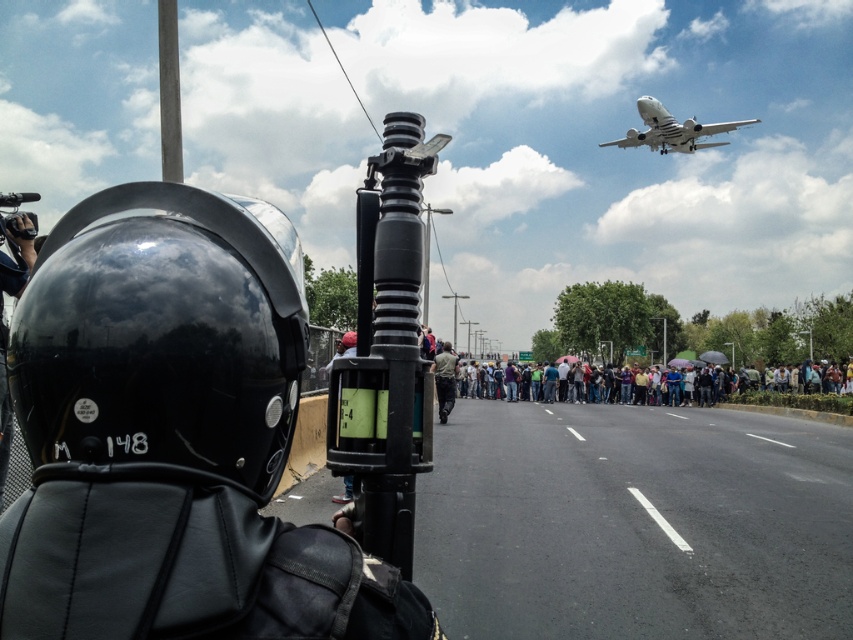
You are standing in the crowd looking towards the road. Which object is closer to you between the matte black helmet at left and the white matte airplane at upper center?

The matte black helmet at left is closer to you because it is positioned under the white matte airplane at upper center, indicating it is in front in the visual hierarchy.

Based on the photo, you are a photographer trying to capture a clear shot of the light brown fabric shirt at center. However, the matte black helmet at left is blocking your view. Based on their sizes, can you estimate whether you can move closer to the scene to get a better shot without the helmet obscuring the shirt?

The matte black helmet at left has a smaller size compared to the light brown fabric shirt at center. Therefore, moving closer might allow you to position yourself so the smaller helmet no longer blocks the larger shirt.

From the picture: You are a pedestrian trying to cross the road safely. You see the matte black helmet at left and the light brown fabric shirt at center. Which object is closer to you?

The matte black helmet at left is closer to you since it is only 1.51 meters away from the light brown fabric shirt at center, which is further away.